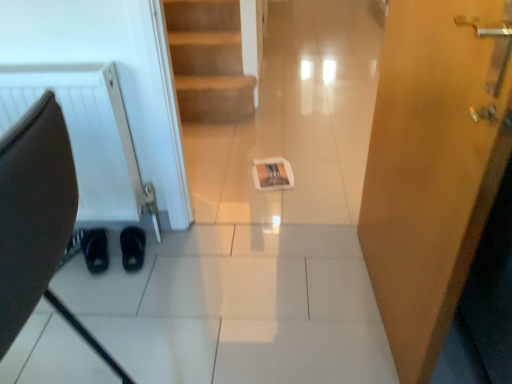
Question: From the image's perspective, is black suede shoes at lower left, the first footwear positioned from the right, located above matte paper magazine at center?

Choices:
 (A) no
 (B) yes

Answer: (A)

Question: Is black suede shoes at lower left, which is the second footwear from left to right, to the right of matte paper magazine at center from the viewer's perspective?

Choices:
 (A) yes
 (B) no

Answer: (B)

Question: Considering the relative sizes of black suede shoes at lower left, which is the second footwear from left to right, and matte paper magazine at center in the image provided, is black suede shoes at lower left, which is the second footwear from left to right, smaller than matte paper magazine at center?

Choices:
 (A) yes
 (B) no

Answer: (B)

Question: From a real-world perspective, does black suede shoes at lower left, the first footwear positioned from the right, stand above matte paper magazine at center?

Choices:
 (A) no
 (B) yes

Answer: (B)

Question: Does black suede shoes at lower left, the first footwear positioned from the right, have a lesser width compared to matte paper magazine at center?

Choices:
 (A) no
 (B) yes

Answer: (B)

Question: Are black suede shoes at lower left, which is the second footwear from left to right, and matte paper magazine at center far apart?

Choices:
 (A) yes
 (B) no

Answer: (B)

Question: From the image's perspective, does brown leather swivel chair at left appear higher than black suede shoes at lower left, which is the 2th footwear in right-to-left order?

Choices:
 (A) no
 (B) yes

Answer: (A)

Question: From a real-world perspective, is brown leather swivel chair at left positioned under black suede shoes at lower left, the first footwear from the left, based on gravity?

Choices:
 (A) no
 (B) yes

Answer: (A)

Question: Can you confirm if brown leather swivel chair at left is thinner than black suede shoes at lower left, the first footwear from the left?

Choices:
 (A) yes
 (B) no

Answer: (B)

Question: Is brown leather swivel chair at left bigger than black suede shoes at lower left, which is the 2th footwear in right-to-left order?

Choices:
 (A) yes
 (B) no

Answer: (A)

Question: Is brown leather swivel chair at left touching black suede shoes at lower left, which is the 2th footwear in right-to-left order?

Choices:
 (A) no
 (B) yes

Answer: (A)

Question: Can you confirm if brown leather swivel chair at left is smaller than black suede shoes at lower left, which is the 2th footwear in right-to-left order?

Choices:
 (A) no
 (B) yes

Answer: (A)

Question: Is white textured radiator at left at the right side of wooden door at right?

Choices:
 (A) no
 (B) yes

Answer: (A)